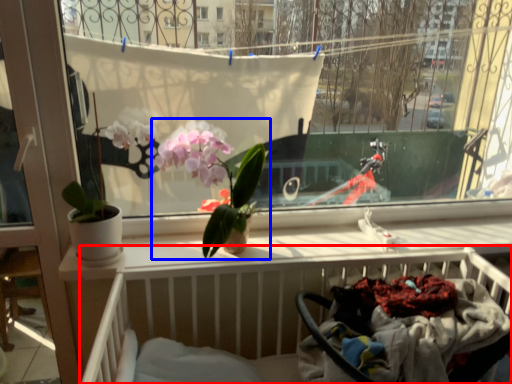
Question: Which of the following is the closest to the observer, hospital bed (highlighted by a red box) or houseplant (highlighted by a blue box)?

Choices:
 (A) hospital bed
 (B) houseplant

Answer: (A)